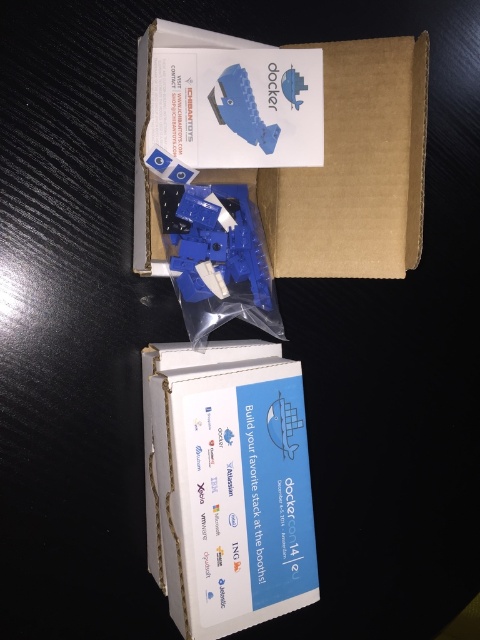
Does blue plastic toy at center have a greater height compared to blue plastic toy at upper center?

Yes, blue plastic toy at center is taller than blue plastic toy at upper center.

Which is behind, point (220, 272) or point (225, 102)?

The point (220, 272) is behind.

What do you see at coordinates (216, 243) in the screenshot? I see `blue plastic toy at center` at bounding box center [216, 243].

I want to click on blue plastic toy at center, so click(x=216, y=243).

Between point (144, 412) and point (238, 88), which one is positioned in front?

Point (238, 88)

Find the location of a particular element. This screenshot has height=640, width=480. white cardboard box at center is located at coordinates (228, 484).

Is brown cardboard box at upper center below blue plastic toy at center?

No, brown cardboard box at upper center is not below blue plastic toy at center.

Can you confirm if brown cardboard box at upper center is shorter than blue plastic toy at center?

No, brown cardboard box at upper center is not shorter than blue plastic toy at center.

This screenshot has height=640, width=480. Find the location of `brown cardboard box at upper center`. brown cardboard box at upper center is located at coordinates (354, 168).

At what (x,y) coordinates should I click in order to perform the action: click on brown cardboard box at upper center. Please return your answer as a coordinate pair (x, y). The image size is (480, 640). Looking at the image, I should click on pyautogui.click(x=354, y=168).